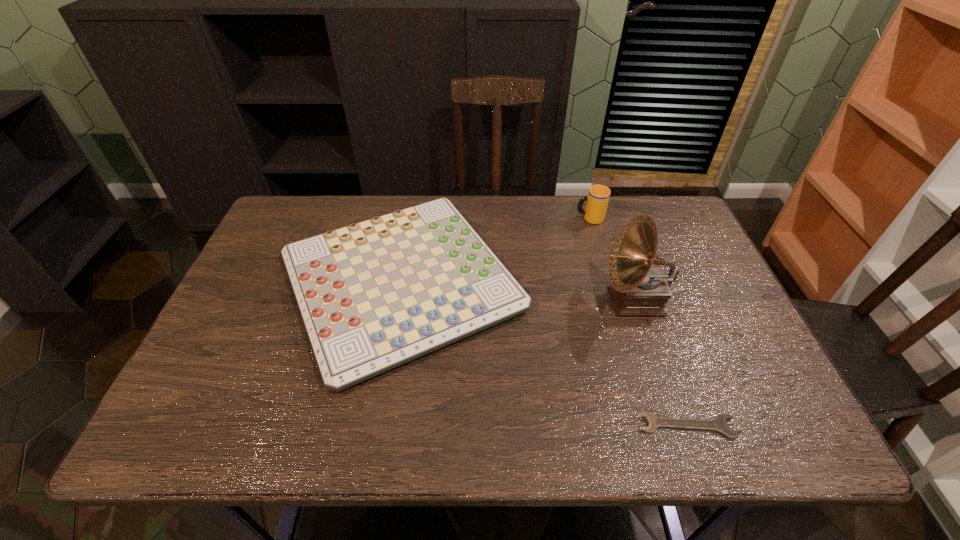
You are a GUI agent. You are given a task and a screenshot of the screen. Output one action in this format:
    pyautogui.click(x=<x>, y=<y>)
    Task: Click on the phonograph record
    The image size is (960, 540).
    Given the screenshot: What is the action you would take?
    pyautogui.click(x=638, y=289)

You are a GUI agent. You are given a task and a screenshot of the screen. Output one action in this format:
    pyautogui.click(x=<x>, y=<y>)
    Task: Click on the cup
    Image resolution: width=960 pixels, height=540 pixels.
    Given the screenshot: What is the action you would take?
    pyautogui.click(x=597, y=200)

Identify the location of the second shortest object. (374, 295).

I want to click on the leftmost object, so click(374, 295).

The height and width of the screenshot is (540, 960). Find the location of `the nearest object`. the nearest object is located at coordinates (718, 424).

This screenshot has width=960, height=540. What are the coordinates of `wrench` in the screenshot? It's located at (718, 424).

Image resolution: width=960 pixels, height=540 pixels. I want to click on vacant space positioned on the horn of the phonograph record, so click(x=463, y=301).

At what (x,y) coordinates should I click in order to perform the action: click on vacant space located 0.220m on the horn of the phonograph record. Please return your answer as a coordinate pair (x, y). This screenshot has height=540, width=960. Looking at the image, I should click on (520, 301).

The height and width of the screenshot is (540, 960). Find the location of `vacant point located 0.300m on the horn of the phonograph record`. vacant point located 0.300m on the horn of the phonograph record is located at coordinates (490, 301).

Where is `vacant point located on the side of the second tallest object with the handle`? The width and height of the screenshot is (960, 540). vacant point located on the side of the second tallest object with the handle is located at coordinates (550, 219).